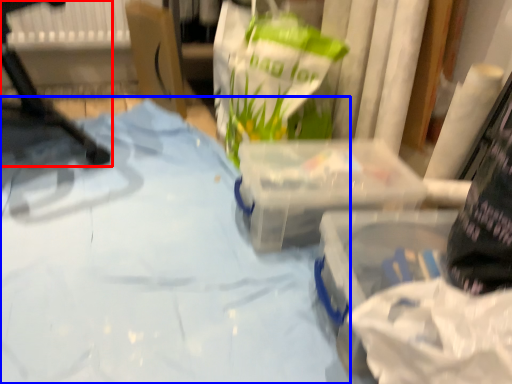
Question: Which object appears closest to the camera in this image, furniture (highlighted by a red box) or sheet (highlighted by a blue box)?

Choices:
 (A) furniture
 (B) sheet

Answer: (B)